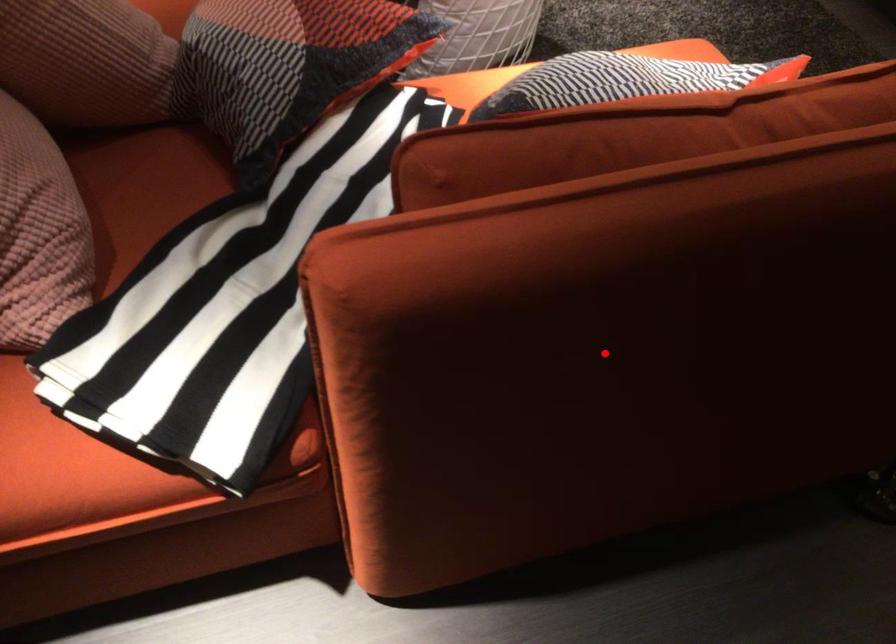
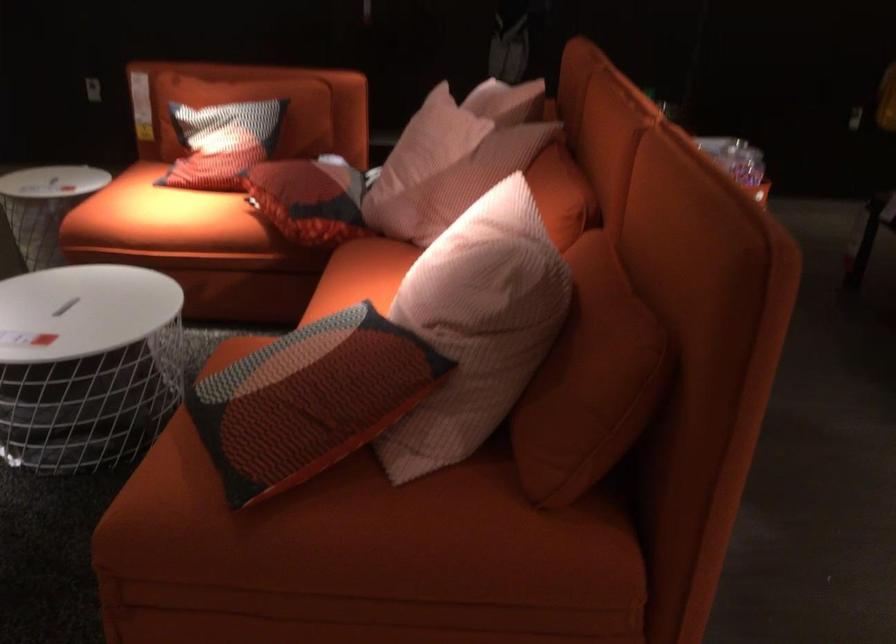
Question: I am providing you with two images of the same scene from different viewpoints. A red point is marked on the first image. At the location where the point appears in image 1, is it still visible in image 2?

Choices:
 (A) Yes
 (B) No

Answer: (B)